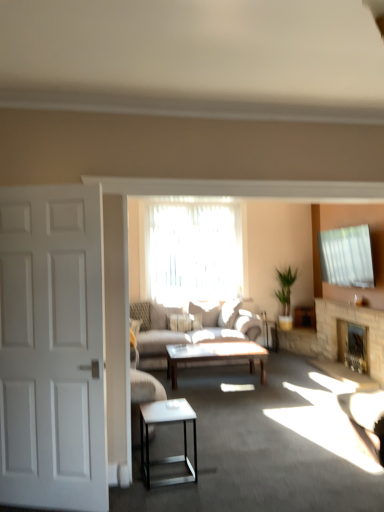
Question: Is light gray fabric couch at center positioned with its back to stone fireplace at center, the second fireplace from the back?

Choices:
 (A) yes
 (B) no

Answer: (B)

Question: Is light gray fabric couch at center at the right side of stone fireplace at center, the second fireplace from the back?

Choices:
 (A) yes
 (B) no

Answer: (B)

Question: Is stone fireplace at center, the first fireplace from the front, a part of light gray fabric couch at center?

Choices:
 (A) no
 (B) yes

Answer: (A)

Question: From a real-world perspective, is light gray fabric couch at center beneath stone fireplace at center, the second fireplace from the back?

Choices:
 (A) yes
 (B) no

Answer: (B)

Question: Considering the relative sizes of light gray fabric couch at center and stone fireplace at center, the first fireplace from the front, in the image provided, is light gray fabric couch at center shorter than stone fireplace at center, the first fireplace from the front,?

Choices:
 (A) yes
 (B) no

Answer: (B)

Question: Considering the positions of translucent fabric at center and stone fireplace at center, the second fireplace from the back, in the image, is translucent fabric at center bigger or smaller than stone fireplace at center, the second fireplace from the back,?

Choices:
 (A) small
 (B) big

Answer: (A)

Question: Is point (162, 264) closer or farther from the camera than point (367, 355)?

Choices:
 (A) farther
 (B) closer

Answer: (A)

Question: From the image's perspective, is translucent fabric at center above or below stone fireplace at center, the first fireplace from the front?

Choices:
 (A) below
 (B) above

Answer: (B)

Question: Considering their positions, is translucent fabric at center located in front of or behind stone fireplace at center, the second fireplace from the back?

Choices:
 (A) front
 (B) behind

Answer: (B)

Question: In terms of height, does stone fireplace at center, the first fireplace from the front, look taller or shorter compared to light gray fabric couch at center?

Choices:
 (A) short
 (B) tall

Answer: (A)

Question: Is point (367, 325) positioned closer to the camera than point (196, 312)?

Choices:
 (A) closer
 (B) farther

Answer: (A)

Question: Looking at their shapes, would you say stone fireplace at center, the first fireplace from the front, is wider or thinner than light gray fabric couch at center?

Choices:
 (A) thin
 (B) wide

Answer: (A)

Question: Would you say stone fireplace at center, the first fireplace from the front, is to the left or to the right of light gray fabric couch at center in the picture?

Choices:
 (A) left
 (B) right

Answer: (B)

Question: Which is correct: translucent fabric at center is inside stone fireplace at center, the second fireplace in the front-to-back sequence, or outside of it?

Choices:
 (A) outside
 (B) inside

Answer: (A)

Question: From a real-world perspective, relative to stone fireplace at center, marked as the first fireplace in a back-to-front arrangement, is translucent fabric at center vertically above or below?

Choices:
 (A) below
 (B) above

Answer: (B)